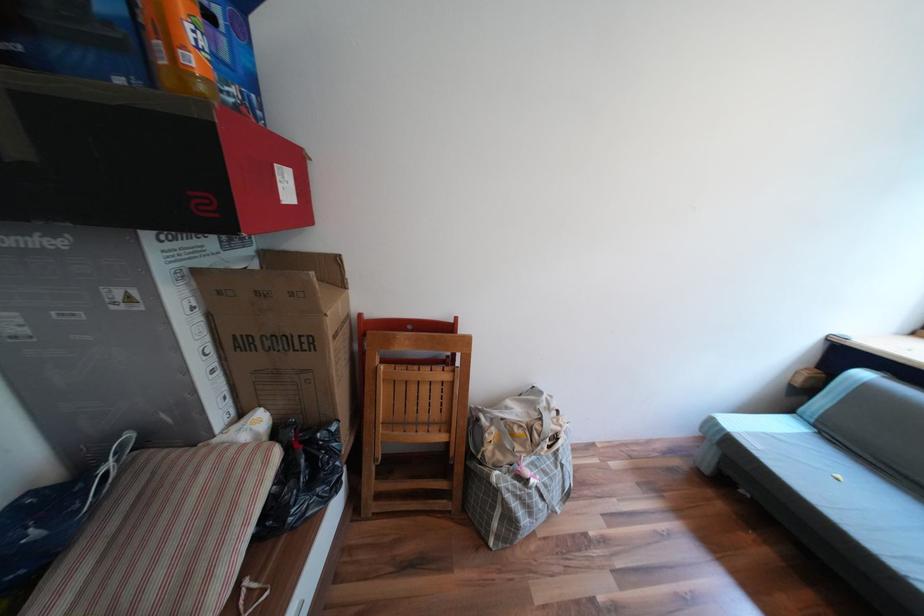
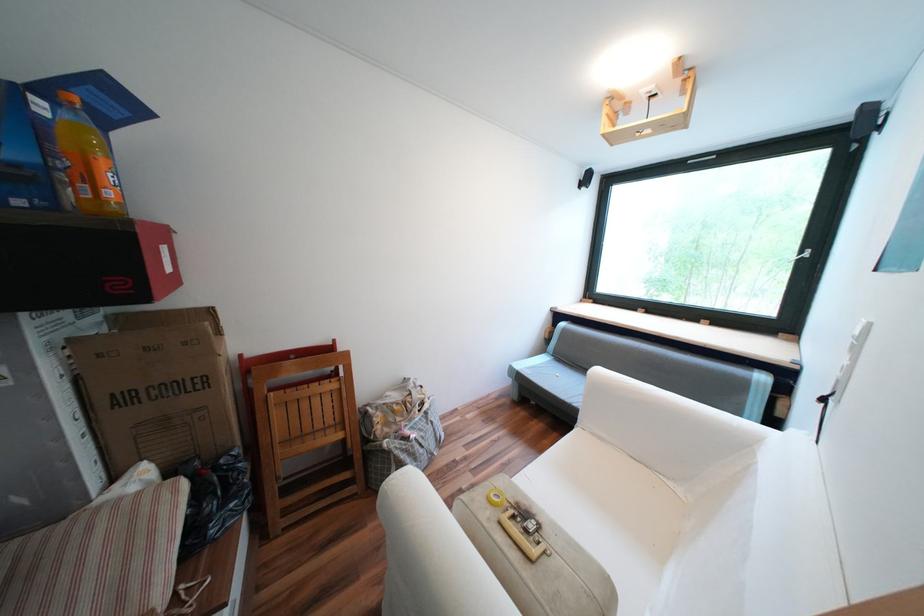
The point at (201, 61) is marked in the first image. Where is the corresponding point in the second image?

(118, 193)